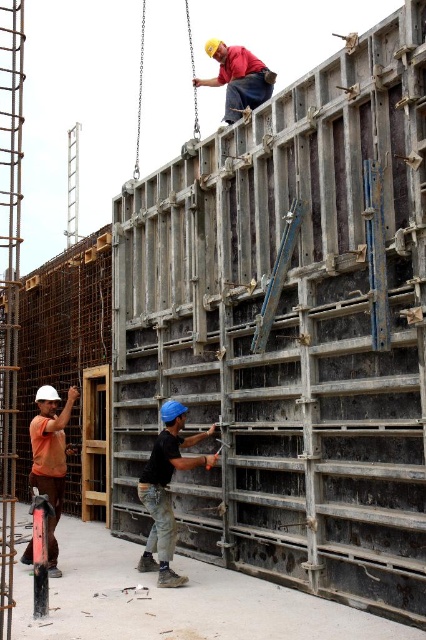
Does black matte construction worker at center have a greater width compared to orange matte shirt at lower left?

Yes.

Who is positioned more to the left, black matte construction worker at center or orange matte shirt at lower left?

Positioned to the left is orange matte shirt at lower left.

Measure the distance between black matte construction worker at center and camera.

A distance of 9.04 meters exists between black matte construction worker at center and camera.

You are a GUI agent. You are given a task and a screenshot of the screen. Output one action in this format:
    pyautogui.click(x=<x>, y=<y>)
    Task: Click on the black matte construction worker at center
    This screenshot has height=640, width=426.
    Given the screenshot: What is the action you would take?
    pyautogui.click(x=166, y=490)

How much distance is there between black matte construction worker at center and matte black shirt at upper center?

7.18 meters

Is black matte construction worker at center to the right of matte black shirt at upper center from the viewer's perspective?

In fact, black matte construction worker at center is to the left of matte black shirt at upper center.

The image size is (426, 640). In order to click on black matte construction worker at center in this screenshot , I will do `click(166, 490)`.

The height and width of the screenshot is (640, 426). Find the location of `black matte construction worker at center`. black matte construction worker at center is located at coordinates (166, 490).

Can you confirm if orange matte shirt at lower left is taller than matte black shirt at upper center?

In fact, orange matte shirt at lower left may be shorter than matte black shirt at upper center.

How much distance is there between orange matte shirt at lower left and matte black shirt at upper center?

orange matte shirt at lower left is 8.79 meters away from matte black shirt at upper center.

Where is `orange matte shirt at lower left`? This screenshot has width=426, height=640. orange matte shirt at lower left is located at coordinates (51, 460).